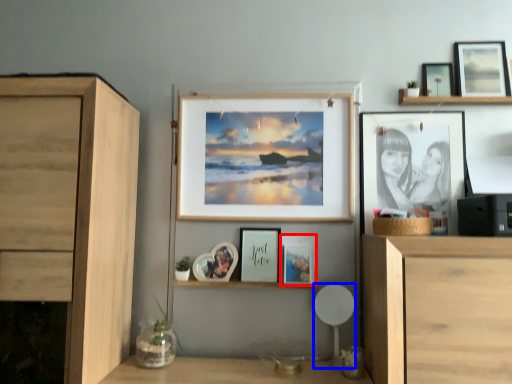
Question: Which object is further to the camera taking this photo, picture frame (highlighted by a red box) or chair (highlighted by a blue box)?

Choices:
 (A) picture frame
 (B) chair

Answer: (A)